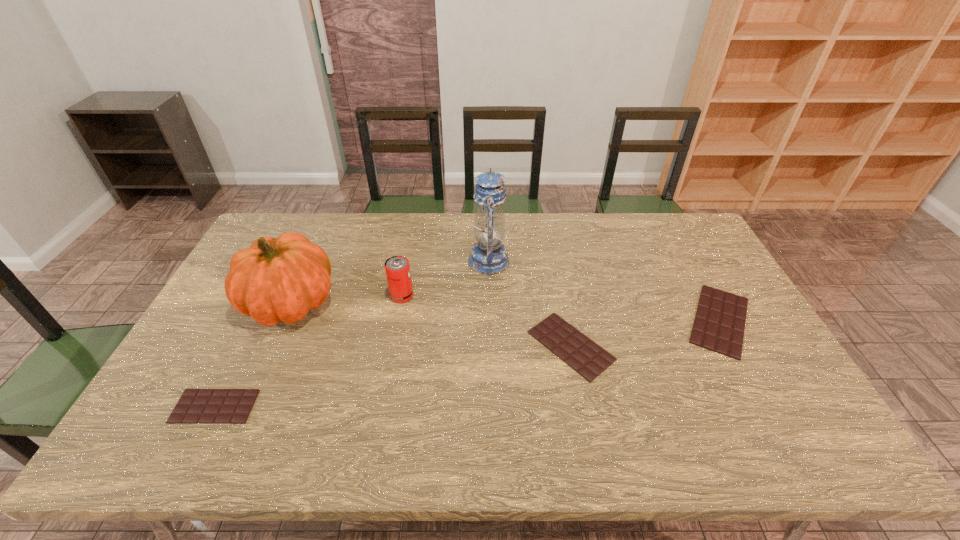
You are a GUI agent. You are given a task and a screenshot of the screen. Output one action in this format:
    pyautogui.click(x=<x>, y=<y>)
    Task: Click on the fourth closest object relative to the fifth object from left to right
    
    Given the screenshot: What is the action you would take?
    pyautogui.click(x=279, y=279)

Identify the location of chocolate bar that stands as the second closest to the leftmost chocolate bar. The height and width of the screenshot is (540, 960). (719, 324).

Select which chocolate bar appears as the second closest to the fifth shortest object. Please provide its 2D coordinates. Your answer should be formatted as a tuple, i.e. [(x, y)], where the tuple contains the x and y coordinates of a point satisfying the conditions above.

[(583, 355)]

Where is `free space in the image that satisfies the following two spatial constraints: 1. on the front-facing side of the fourth object from left to right; 2. on the left side of the fifth tallest object`? free space in the image that satisfies the following two spatial constraints: 1. on the front-facing side of the fourth object from left to right; 2. on the left side of the fifth tallest object is located at coordinates (491, 346).

Where is `vacant space that satisfies the following two spatial constraints: 1. on the front-facing side of the fourth object from left to right; 2. on the front side of the nearest object`? vacant space that satisfies the following two spatial constraints: 1. on the front-facing side of the fourth object from left to right; 2. on the front side of the nearest object is located at coordinates (492, 406).

Locate an element on the screen. The width and height of the screenshot is (960, 540). vacant region that satisfies the following two spatial constraints: 1. on the front-facing side of the lantern; 2. on the right side of the rightmost chocolate bar is located at coordinates (491, 320).